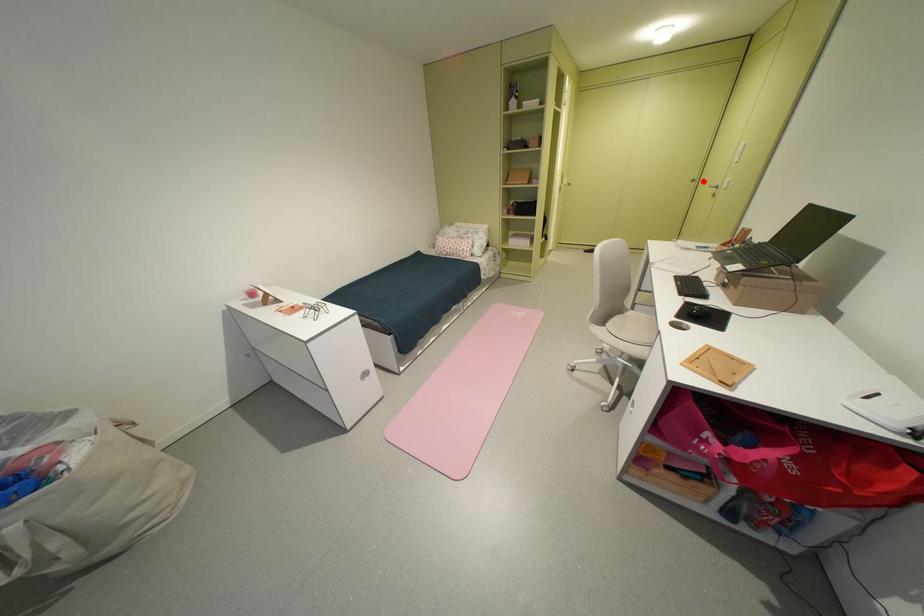
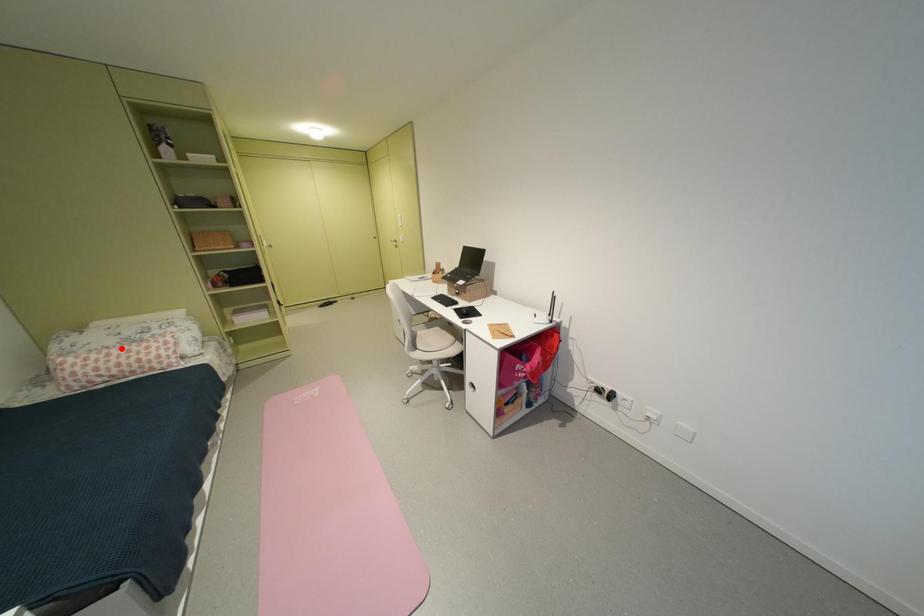
I am providing you with two images of the same scene from different viewpoints. A red point is marked on the first image and another point is marked on the second image. Do the highlighted points in image1 and image2 indicate the same real-world spot?

No